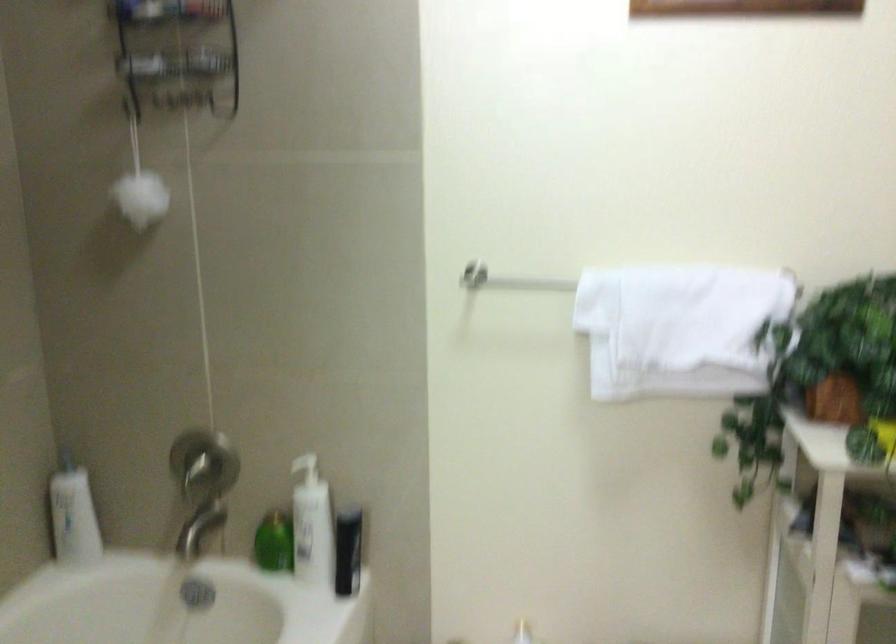
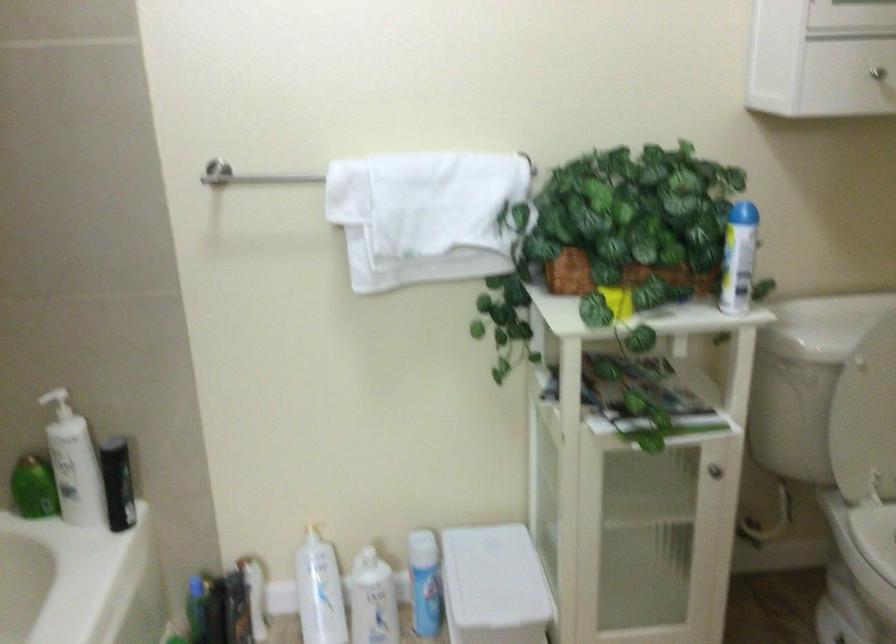
The point at (304,469) is marked in the first image. Where is the corresponding point in the second image?

(56, 402)